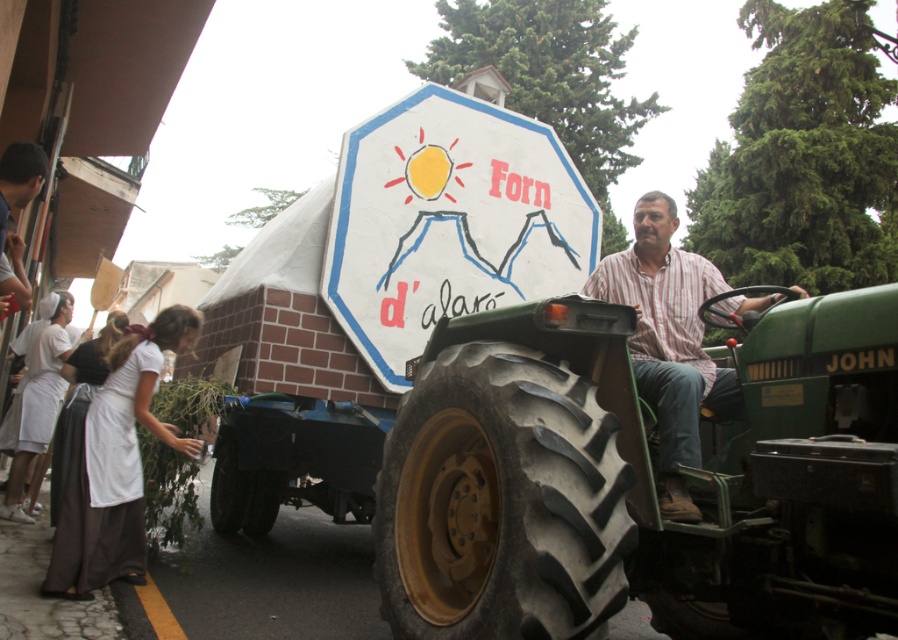
Can you confirm if green rubber tractor at center is positioned below white painted sign at center?

Indeed, green rubber tractor at center is positioned under white painted sign at center.

Can you confirm if green rubber tractor at center is positioned to the left of white painted sign at center?

Incorrect, green rubber tractor at center is not on the left side of white painted sign at center.

Where is `green rubber tractor at center`? This screenshot has height=640, width=898. green rubber tractor at center is located at coordinates (608, 474).

Is point (527, 417) farther from viewer compared to point (82, 492)?

No.

Is point (436, 556) in front of point (128, 435)?

Yes, point (436, 556) is in front of point (128, 435).

Locate an element on the screen. The width and height of the screenshot is (898, 640). green rubber tractor at center is located at coordinates (608, 474).

Who is more forward, (692, 298) or (134, 385)?

Point (692, 298) is more forward.

Which of these two, striped cotton shirt at center or white cotton apron at lower left, stands taller?

white cotton apron at lower left is taller.

You are a GUI agent. You are given a task and a screenshot of the screen. Output one action in this format:
    pyautogui.click(x=<x>, y=<y>)
    Task: Click on the striped cotton shirt at center
    The height and width of the screenshot is (640, 898).
    Given the screenshot: What is the action you would take?
    pyautogui.click(x=668, y=340)

What are the coordinates of `striped cotton shirt at center` in the screenshot? It's located at (668, 340).